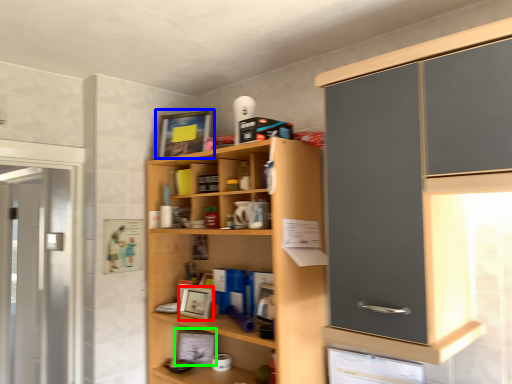
Question: Based on their relative distances, which object is farther from picture frame (highlighted by a red box)? Choose from picture frame (highlighted by a blue box) and picture frame (highlighted by a green box).

Choices:
 (A) picture frame
 (B) picture frame

Answer: (A)